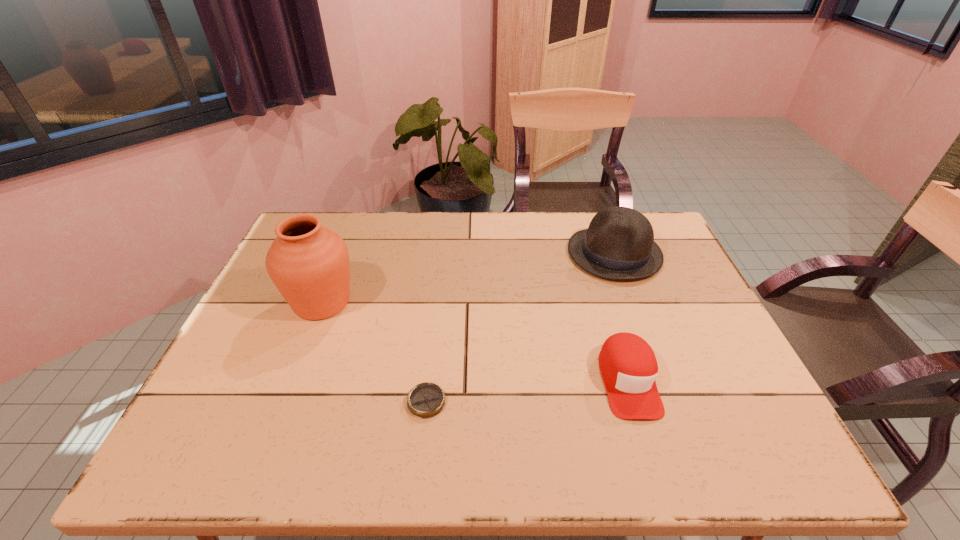
Identify the location of vacant space located on the right of the third object from right to left. pyautogui.click(x=509, y=402).

You are a GUI agent. You are given a task and a screenshot of the screen. Output one action in this format:
    pyautogui.click(x=<x>, y=<y>)
    Task: Click on the object situated at the far edge
    
    Given the screenshot: What is the action you would take?
    pyautogui.click(x=619, y=244)

The height and width of the screenshot is (540, 960). Identify the location of object that is at the left edge. (309, 264).

This screenshot has height=540, width=960. Identify the location of object located in the right edge section of the desktop. (619, 244).

Find the location of `object present at the far right corner`. object present at the far right corner is located at coordinates (619, 244).

You are a GUI agent. You are given a task and a screenshot of the screen. Output one action in this format:
    pyautogui.click(x=<x>, y=<y>)
    Task: Click on the free space at the far edge
    The height and width of the screenshot is (540, 960).
    Given the screenshot: What is the action you would take?
    pyautogui.click(x=514, y=247)

At what (x,y) coordinates should I click in order to perform the action: click on vacant area at the near edge. Please return your answer as a coordinate pair (x, y). This screenshot has height=540, width=960. Looking at the image, I should click on (577, 432).

Identify the location of vacant space at the left edge of the desktop. (278, 302).

The image size is (960, 540). In order to click on free region at the right edge of the desktop in this screenshot , I will do `click(746, 415)`.

Image resolution: width=960 pixels, height=540 pixels. Identify the location of blank area at the far left corner. (335, 232).